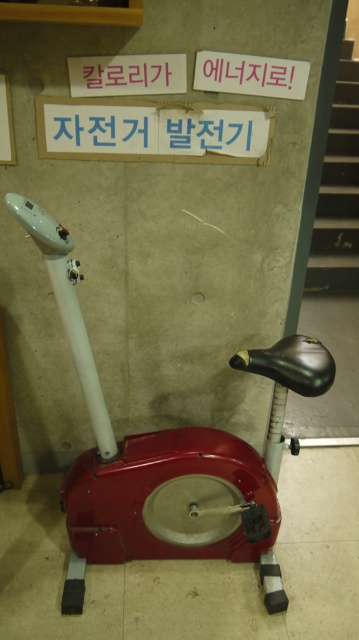
You are a person with a height of 1.7 meters. You are standing in front of the metallic red exercise bike at center and the smooth concrete stairs at right. Which object is taller than you?

The smooth concrete stairs at right are taller than you since the metallic red exercise bike at center is not as tall as smooth concrete stairs at right, and you are 1.7 meters tall.